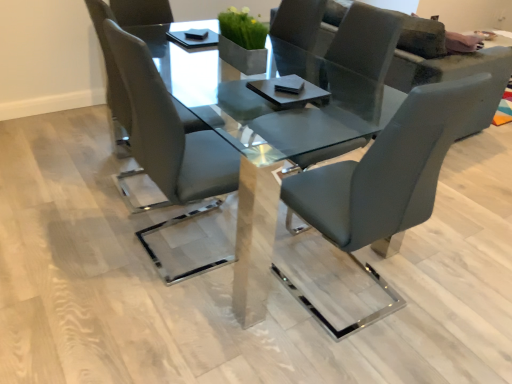
At what (x,y) coordinates should I click in order to perform the action: click on vacant area that lies in front of clear glass table at center. Please return your answer as a coordinate pair (x, y). Looking at the image, I should click on (178, 311).